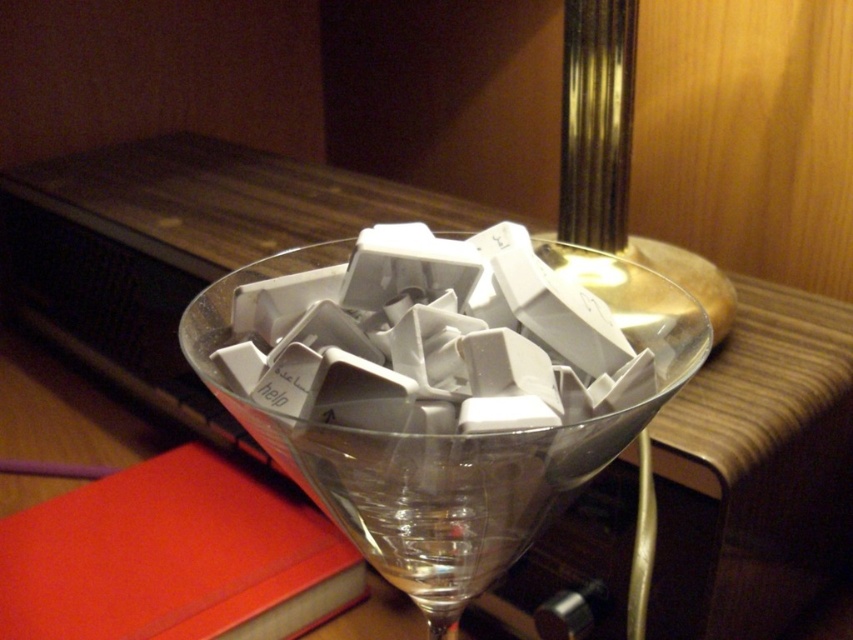
Question: Which of the following is the closest to the observer?

Choices:
 (A) (685, 344)
 (B) (137, 515)

Answer: (A)

Question: Among these objects, which one is farthest from the camera?

Choices:
 (A) red matte book at lower left
 (B) transparent glass at center

Answer: (A)

Question: Does transparent glass at center appear on the right side of red matte book at lower left?

Choices:
 (A) yes
 (B) no

Answer: (A)

Question: Can you confirm if transparent glass at center is positioned to the left of red matte book at lower left?

Choices:
 (A) no
 (B) yes

Answer: (A)

Question: Considering the relative positions of transparent glass at center and red matte book at lower left in the image provided, where is transparent glass at center located with respect to red matte book at lower left?

Choices:
 (A) above
 (B) below

Answer: (A)